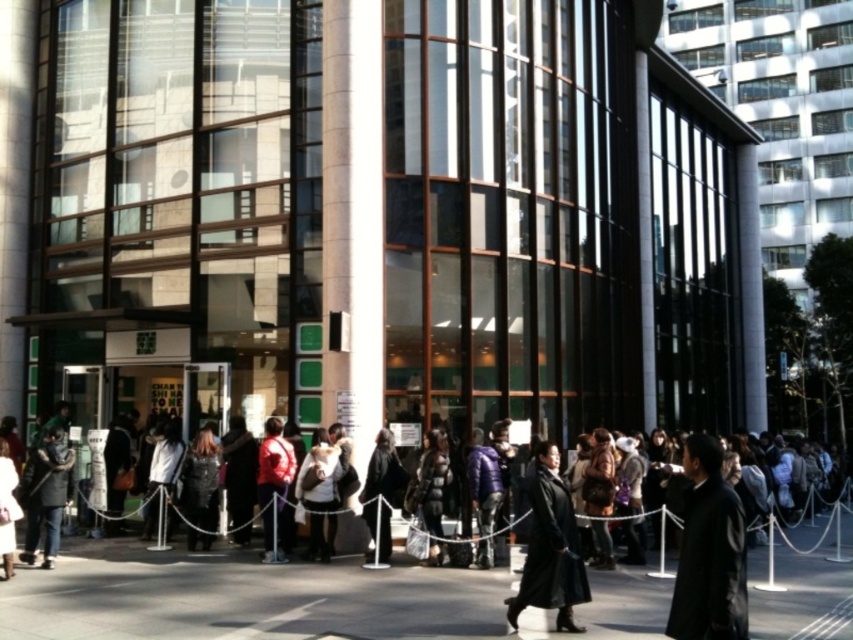
Does point (54, 525) lie behind point (224, 477)?

No.

Does dark gray fabric coat at lower left have a lesser width compared to velvet black coat at center?

Incorrect, dark gray fabric coat at lower left's width is not less than velvet black coat at center's.

Is point (51, 564) less distant than point (234, 467)?

Yes, point (51, 564) is in front of point (234, 467).

Find the location of a particular element. Image resolution: width=853 pixels, height=640 pixels. dark gray fabric coat at lower left is located at coordinates (47, 496).

Does white glossy pillar at center have a lesser height compared to black fabric coat at center?

Yes.

Consider the image. Measure the distance between white glossy pillar at center and black fabric coat at center.

white glossy pillar at center is 5.04 feet away from black fabric coat at center.

Is point (373, 97) farther from camera compared to point (368, 472)?

Yes, it is behind point (368, 472).

I want to click on white glossy pillar at center, so click(x=352, y=220).

Which is in front, point (42, 509) or point (488, 467)?

Positioned in front is point (42, 509).

Which is behind, point (71, 449) or point (498, 490)?

Positioned behind is point (498, 490).

Which is in front, point (28, 518) or point (480, 516)?

Positioned in front is point (28, 518).

What are the coordinates of `dark gray fabric coat at lower left` in the screenshot? It's located at point(47,496).